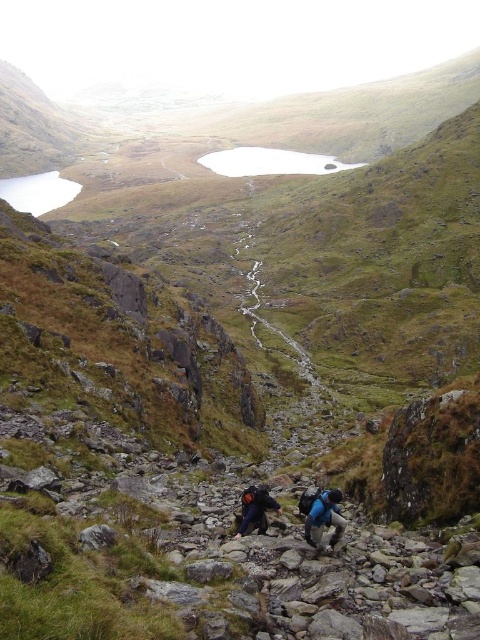
You are a hiker who needs to refill your water bottle. You see clear water at center and blue fabric backpack at lower center. Which one is closer to you?

The blue fabric backpack at lower center is closer to you since it is at lower center, while the clear water at center is farther away.

Looking at this image, you are a hiker planning to carry both the blue fabric backpacks at center and the dark blue backpack at center on a narrow mountain trail. Which backpack should you choose to carry on your back to ensure better stability while navigating the rocky path?

You should choose the dark blue backpack at center because it is taller than the blue fabric backpacks at center, providing better stability on uneven terrain.

You are a hiker planning to cross the rocky path in the image. You see the blue fabric backpack at lower center and the dark blue backpack at center. Which backpack is positioned higher up the trail?

The blue fabric backpack at lower center is positioned higher up the trail than the dark blue backpack at center.